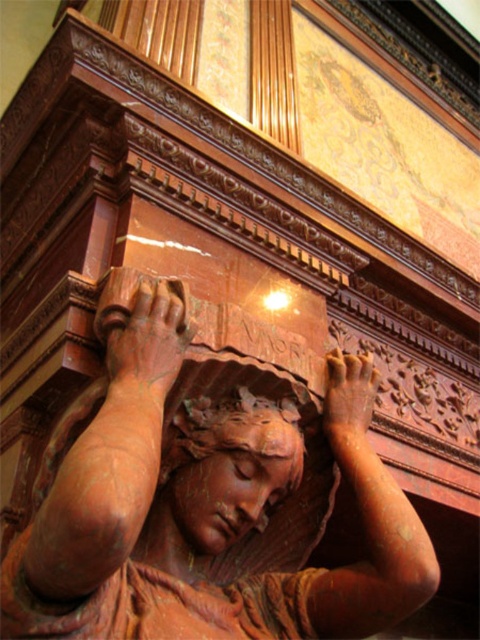
You are an art conservator examining the carved wooden figure. You notice a specific point at coordinates (229, 465). Based on the description, which part of the figure is this point located on?

The point at (229, 465) is located on the matte terracotta head at center.

In the scene shown: You are standing in front of a carved wooden figure. There is a rustic terracotta statue at center located at point (196, 509). If you want to place a small decoration exactly at the center of the statue, where should you place it?

The rustic terracotta statue at center is located at point (196, 509), so you should place the small decoration at that coordinate to position it exactly at the center of the statue.

You are an art conservator examining the carved wooden figure. You notice the matte terracotta head at center and the brown wood hand at center. Which object is positioned in front of the other?

The matte terracotta head at center is closer to the viewer than the brown wood hand at center, so it is positioned in front of it.